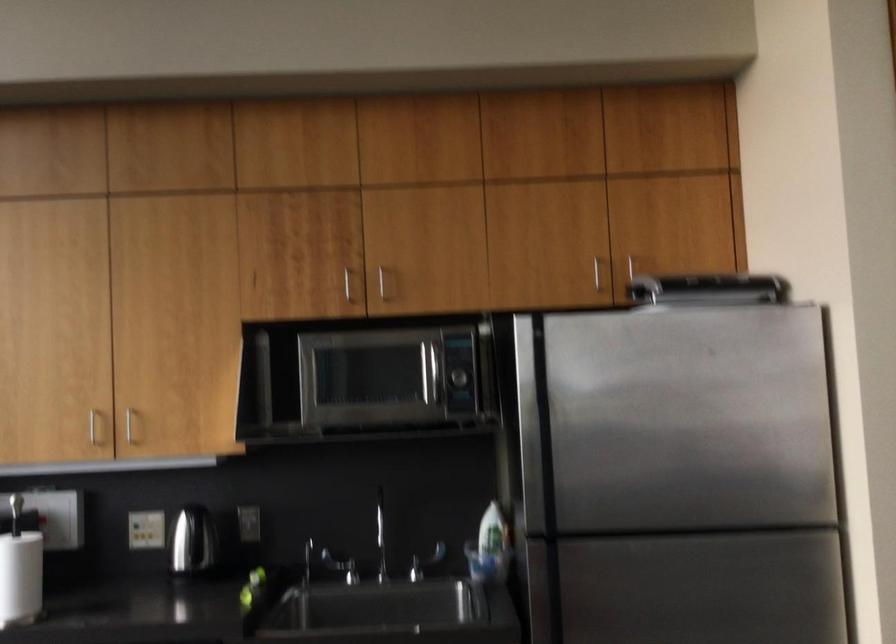
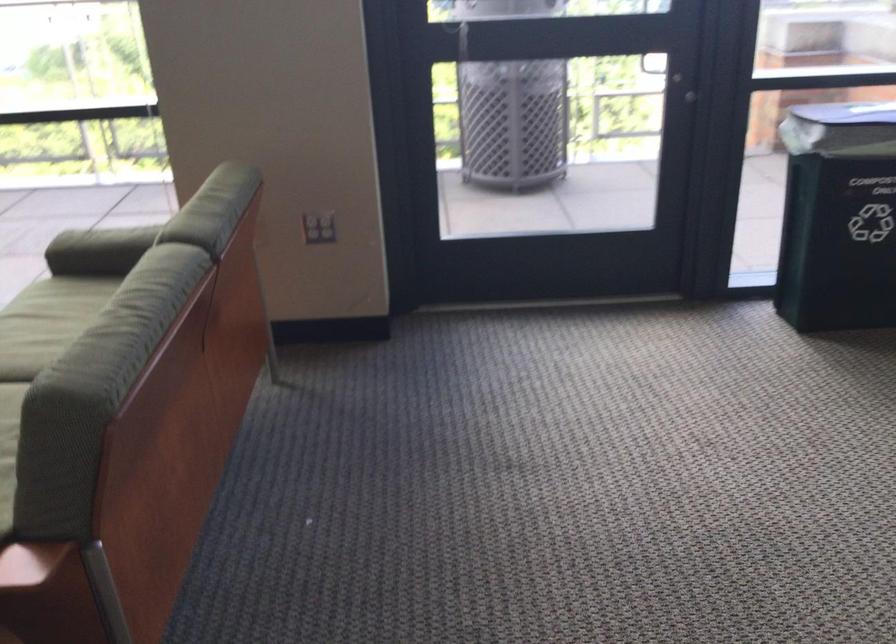
First-person continuous shooting, in which direction is the camera rotating?

The camera's rotation is toward left-down.